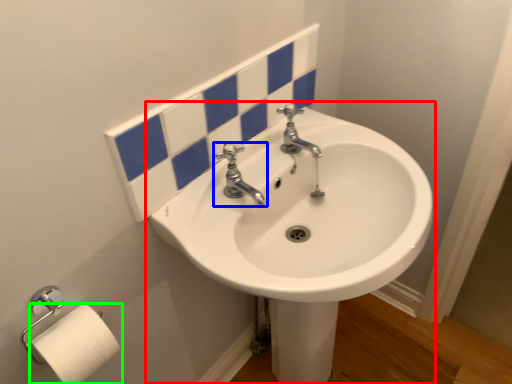
Question: Based on their relative distances, which object is farther from sink (highlighted by a red box)? Choose from tap (highlighted by a blue box) and toilet paper (highlighted by a green box).

Choices:
 (A) tap
 (B) toilet paper

Answer: (B)